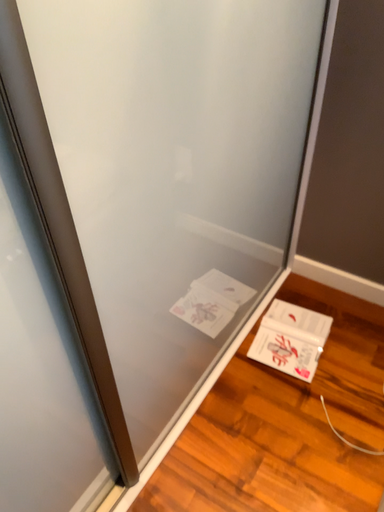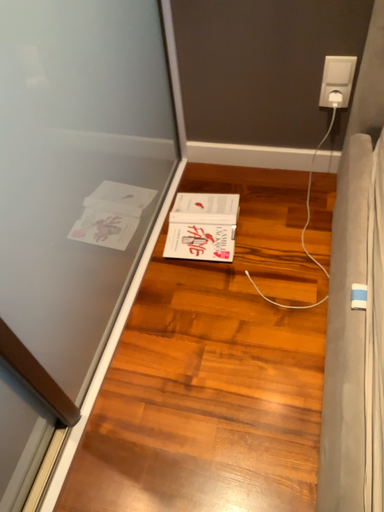
Question: Which way did the camera rotate in the video?

Choices:
 (A) rotated left
 (B) rotated right

Answer: (B)